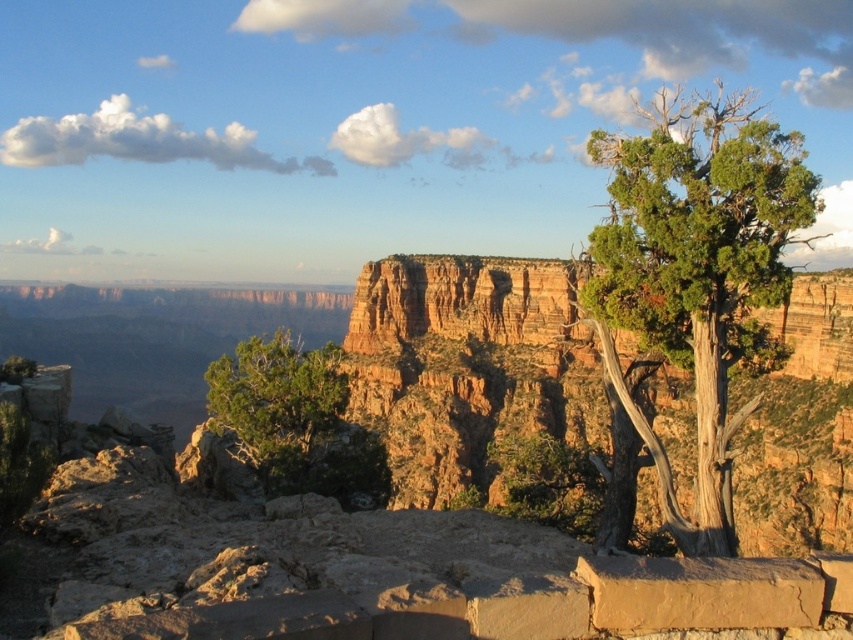
Is green textured tree at upper right thinner than green rough textured bush at lower left?

Incorrect, green textured tree at upper right's width is not less than green rough textured bush at lower left's.

Between point (706, 97) and point (303, 353), which one is positioned behind?

The point (706, 97) is behind.

This screenshot has width=853, height=640. What are the coordinates of `green textured tree at upper right` in the screenshot? It's located at (692, 284).